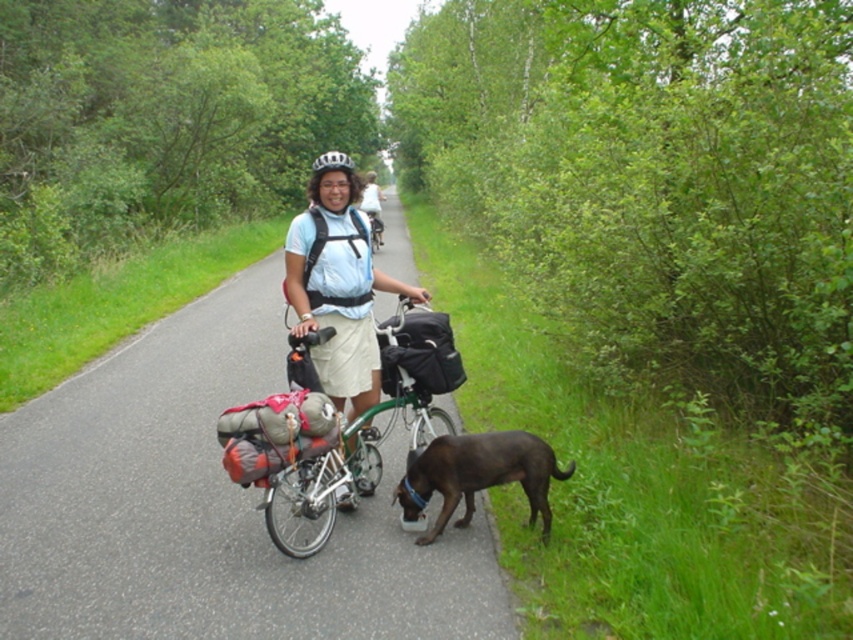
You are a photographer trying to capture a clear shot of both the silver metallic bicycle at center and the brown matte dog at lower center. Since the bicycle is taller than the dog, where should you position your camera to ensure both subjects are fully visible in the frame?

The silver metallic bicycle at center is taller than the brown matte dog at lower center. To capture both fully, position the camera at a lower angle so the bicycle doesn

You are a pedestrian walking along the path and see the matte white shirt at center and the green matte bicycle at center. Which object is positioned to the right?

The matte white shirt at center is to the right of the green matte bicycle at center.